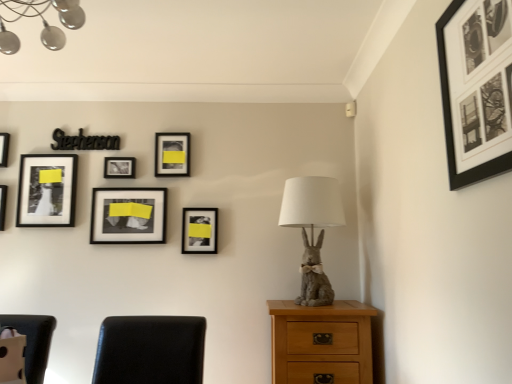
Question: Is black matte picture frame at upper right, acting as the 8th picture frame starting from the left, far from matte black picture frame at left, which ranks as the 7th picture frame in right-to-left order?

Choices:
 (A) no
 (B) yes

Answer: (B)

Question: From a real-world perspective, is black matte picture frame at upper right, which is the eighth picture frame from back to front, under matte black picture frame at left, the 2th picture frame from the left?

Choices:
 (A) no
 (B) yes

Answer: (A)

Question: From the image's perspective, would you say black matte picture frame at upper right, acting as the 8th picture frame starting from the left, is shown under matte black picture frame at left, which ranks as the 7th picture frame in right-to-left order?

Choices:
 (A) no
 (B) yes

Answer: (A)

Question: Is black matte picture frame at upper right, which is the eighth picture frame from back to front, turned away from matte black picture frame at left, the fourth picture frame positioned from the front?

Choices:
 (A) no
 (B) yes

Answer: (A)

Question: Does black matte picture frame at upper right, acting as the 8th picture frame starting from the left, appear on the left side of matte black picture frame at left, which ranks as the 7th picture frame in right-to-left order?

Choices:
 (A) no
 (B) yes

Answer: (A)

Question: Is black matte picture frame at upper right, which is the eighth picture frame from back to front, positioned before matte black picture frame at left, the 2th picture frame from the left?

Choices:
 (A) yes
 (B) no

Answer: (A)

Question: Is matte black picture frame at center, which is counted as the 4th picture frame, starting from the right, wider than matte black picture frame at upper left, which appears as the first picture frame when viewed from the back?

Choices:
 (A) no
 (B) yes

Answer: (B)

Question: From the image's perspective, would you say matte black picture frame at center, which is counted as the 4th picture frame, starting from the right, is shown under matte black picture frame at upper left, which is the eighth picture frame in right-to-left order?

Choices:
 (A) yes
 (B) no

Answer: (A)

Question: From a real-world perspective, is matte black picture frame at center, the fifth picture frame in the left-to-right sequence, below matte black picture frame at upper left, which is the eighth picture frame in right-to-left order?

Choices:
 (A) yes
 (B) no

Answer: (A)

Question: From a real-world perspective, is matte black picture frame at center, the sixth picture frame when ordered from back to front, located higher than matte black picture frame at upper left, which is the eighth picture frame in right-to-left order?

Choices:
 (A) yes
 (B) no

Answer: (B)

Question: Is matte black picture frame at center, the sixth picture frame when ordered from back to front, smaller than matte black picture frame at upper left, which appears as the first picture frame when viewed from the back?

Choices:
 (A) no
 (B) yes

Answer: (A)

Question: Is matte black picture frame at center, the fifth picture frame in the left-to-right sequence, outside of matte black picture frame at upper left, the eighth picture frame from the front?

Choices:
 (A) no
 (B) yes

Answer: (B)

Question: From a real-world perspective, is matte black picture frame at upper center, the second picture frame positioned from the back, physically above matte black picture frame at center, the second picture frame viewed from the right?

Choices:
 (A) yes
 (B) no

Answer: (A)